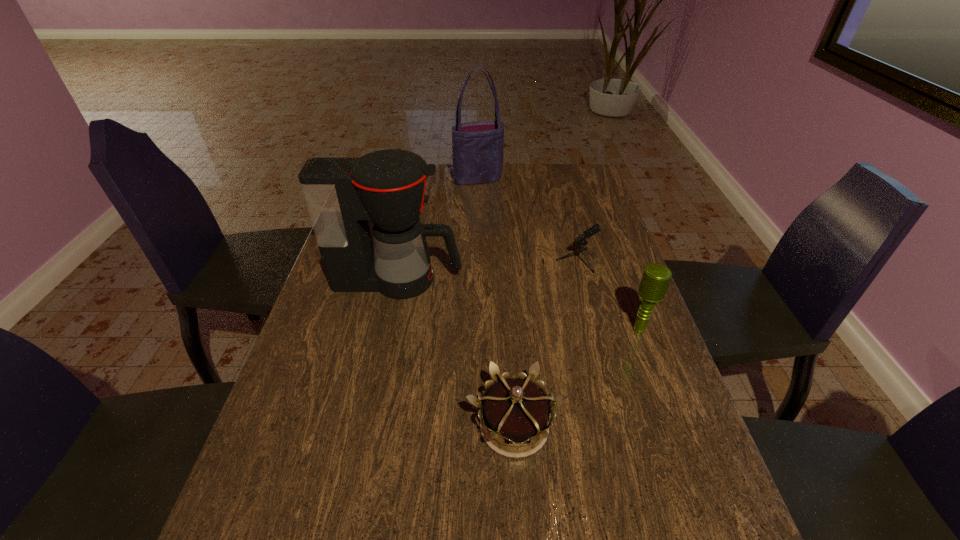
Locate an element on the screen. The height and width of the screenshot is (540, 960). free location located 0.050m on the front of the crown is located at coordinates (518, 494).

The height and width of the screenshot is (540, 960). What are the coordinates of `vacant space located 0.360m on the stand of the shorter microphone` in the screenshot? It's located at (400, 260).

Find the location of a particular element. The width and height of the screenshot is (960, 540). blank area located 0.230m on the stand of the shorter microphone is located at coordinates 445,260.

Where is `vacant space situated on the stand of the shorter microphone`? vacant space situated on the stand of the shorter microphone is located at coordinates (490, 260).

I want to click on object that is at the far edge, so click(477, 147).

Find the location of a particular element. Image resolution: width=960 pixels, height=540 pixels. object situated at the left edge is located at coordinates (388, 187).

Locate an element on the screen. free space at the far edge is located at coordinates (439, 186).

Where is `vacant space at the left edge of the desktop`? This screenshot has height=540, width=960. vacant space at the left edge of the desktop is located at coordinates (231, 517).

The image size is (960, 540). I want to click on free space at the right edge, so click(625, 379).

Where is `vacant space at the far right corner of the desktop`? Image resolution: width=960 pixels, height=540 pixels. vacant space at the far right corner of the desktop is located at coordinates (570, 166).